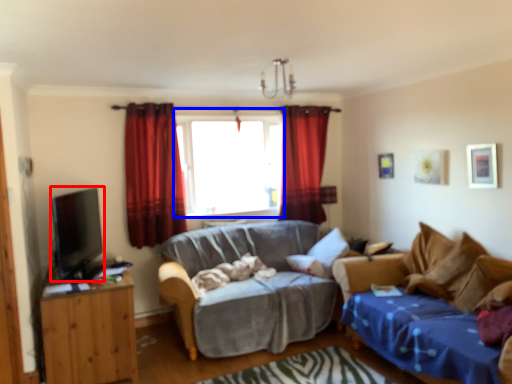
Question: Which of the following is the closest to the observer, open (highlighted by a red box) or window (highlighted by a blue box)?

Choices:
 (A) open
 (B) window

Answer: (A)